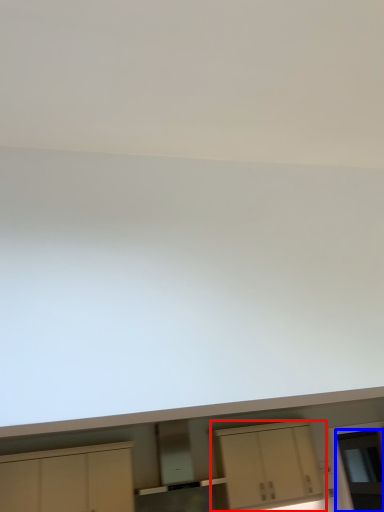
Question: Which point is further to the camera, cabinetry (highlighted by a red box) or glass door (highlighted by a blue box)?

Choices:
 (A) cabinetry
 (B) glass door

Answer: (B)